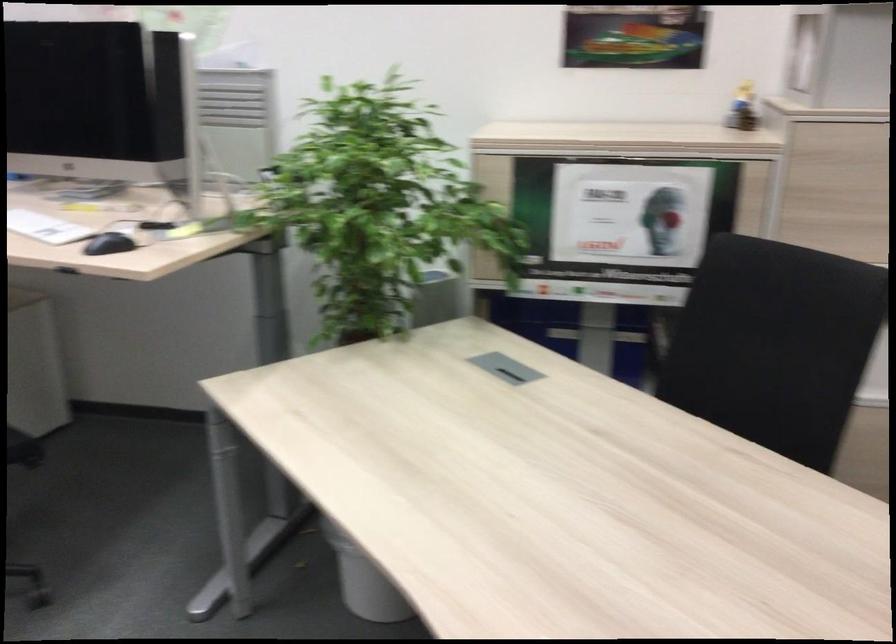
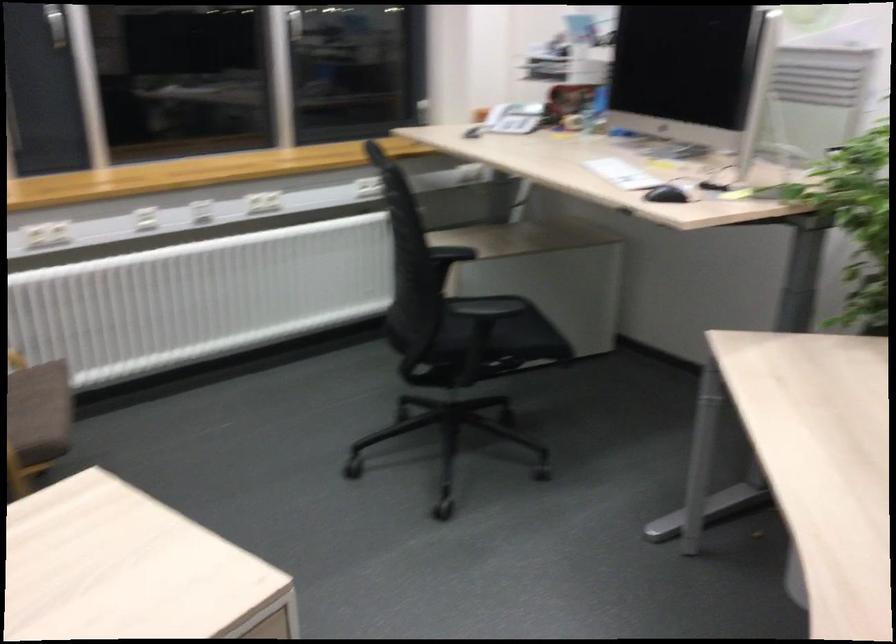
Find the pixel in the second image that matches [108,251] in the first image.

(666, 194)